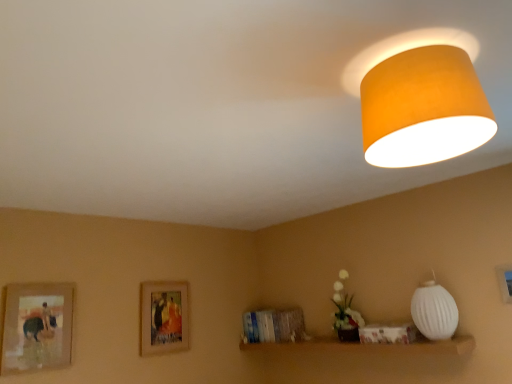
Question: From their relative heights in the image, would you say wooden framed picture at center, which appears as the 2th picture frame when viewed from the left, is taller or shorter than orange fabric lampshade at upper right, placed as the first lamp when sorted from top to bottom?

Choices:
 (A) tall
 (B) short

Answer: (A)

Question: Considering their positions, is wooden framed picture at center, placed as the 3th picture frame when sorted from front to back, located in front of or behind orange fabric lampshade at upper right, which is counted as the 1th lamp, starting from the front?

Choices:
 (A) front
 (B) behind

Answer: (B)

Question: Which is nearer to the white matte vase at lower center?

Choices:
 (A) white ribbed lampshade at right, marked as the second lamp in a top-to-bottom arrangement
 (B) wooden framed picture at left, marked as the 2th picture frame in a back-to-front arrangement
 (C) matte wooden picture frame at lower right, the third picture frame positioned from the back
 (D) orange fabric lampshade at upper right, marked as the first lamp in a left-to-right arrangement
 (E) wooden framed picture at center, placed as the 3th picture frame when sorted from front to back

Answer: (A)

Question: Which of these objects is positioned farthest from the white ribbed lampshade at right, which is the 2th lamp from front to back?

Choices:
 (A) wooden framed picture at left, positioned as the 3th picture frame in right-to-left order
 (B) matte wooden picture frame at lower right, the 3th picture frame when ordered from left to right
 (C) wooden framed picture at center, placed as the 3th picture frame when sorted from front to back
 (D) white matte vase at lower center
 (E) orange fabric lampshade at upper right, marked as the first lamp in a left-to-right arrangement

Answer: (A)